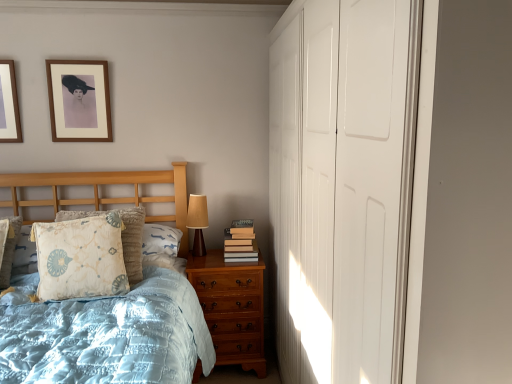
You are a GUI agent. You are given a task and a screenshot of the screen. Output one action in this format:
    pyautogui.click(x=<x>, y=<y>)
    Task: Click on the free space to the left of hardcover books at right
    
    Given the screenshot: What is the action you would take?
    pyautogui.click(x=205, y=261)